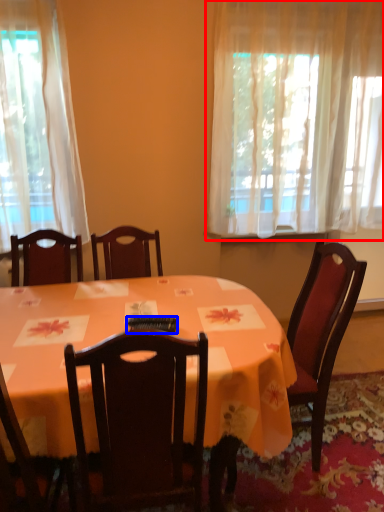
Question: Which of the following is the farthest to the observer, curtain (highlighted by a red box) or remote control (highlighted by a blue box)?

Choices:
 (A) curtain
 (B) remote control

Answer: (A)